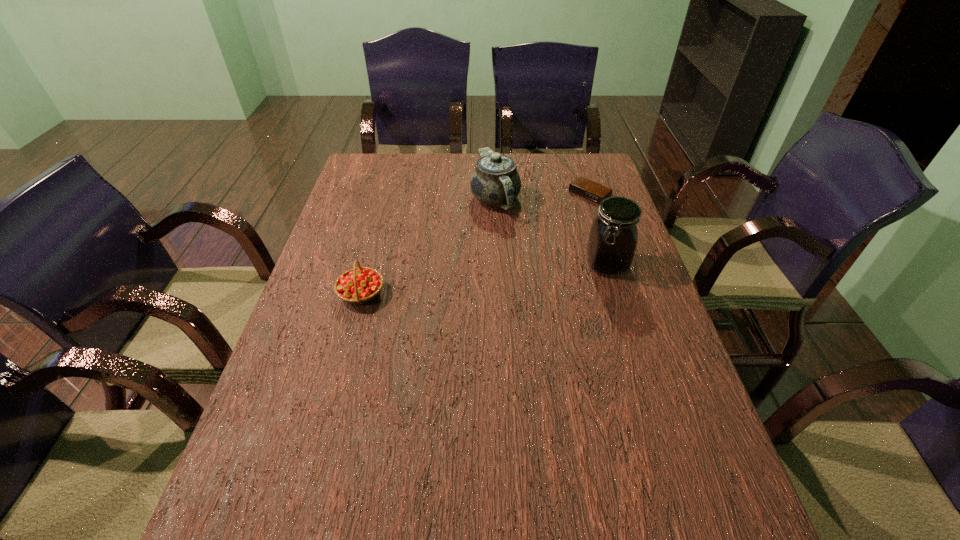
Where is `free space located on the front face of the shortest object`? The image size is (960, 540). free space located on the front face of the shortest object is located at coordinates (516, 249).

Find the location of a particular element. The image size is (960, 540). free region located 0.380m from the spout of the chinaware is located at coordinates (500, 316).

You are a GUI agent. You are given a task and a screenshot of the screen. Output one action in this format:
    pyautogui.click(x=<x>, y=<y>)
    Task: Click on the vacant area situated 0.210m from the spout of the chinaware
    
    Given the screenshot: What is the action you would take?
    pyautogui.click(x=498, y=269)

At what (x,y) coordinates should I click in order to perform the action: click on vacant space located from the spout of the chinaware. Please return your answer as a coordinate pair (x, y). Looking at the image, I should click on (498, 285).

The image size is (960, 540). I want to click on alarm clock present at the far edge, so click(x=583, y=187).

I want to click on chinaware present at the far edge, so click(x=495, y=181).

You are a GUI agent. You are given a task and a screenshot of the screen. Output one action in this format:
    pyautogui.click(x=<x>, y=<y>)
    Task: Click on the object at the left edge
    
    Given the screenshot: What is the action you would take?
    coord(361,285)

Where is `jar present at the right edge`? jar present at the right edge is located at coordinates (613, 237).

Locate an element on the screen. This screenshot has width=960, height=540. alarm clock that is positioned at the right edge is located at coordinates (583, 187).

You are a GUI agent. You are given a task and a screenshot of the screen. Output one action in this format:
    pyautogui.click(x=<x>, y=<y>)
    Task: Click on the object that is at the far right corner
    This screenshot has height=540, width=960.
    Given the screenshot: What is the action you would take?
    pyautogui.click(x=583, y=187)